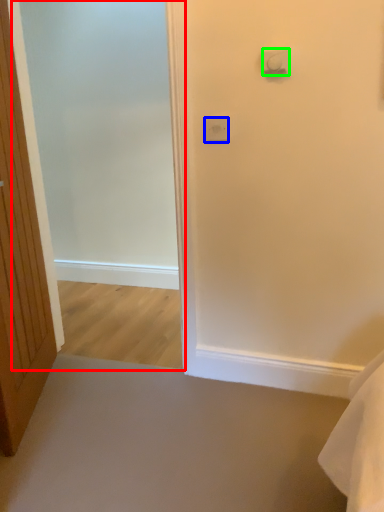
Question: Which is farther away from screen door (highlighted by a red box)? light switch (highlighted by a blue box) or light switch (highlighted by a green box)?

Choices:
 (A) light switch
 (B) light switch

Answer: (B)